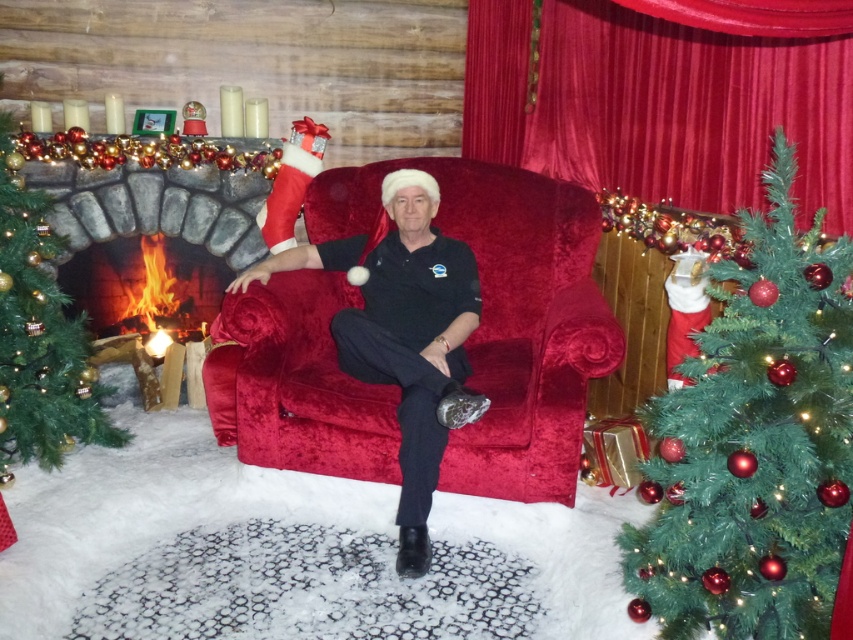
In the scene shown: Is velvet black shirt at center in front of black velvet pants at center?

That is True.

Is point (480, 413) more distant than point (349, 326)?

No, it is in front of (349, 326).

The height and width of the screenshot is (640, 853). Identify the location of velvet black shirt at center. (404, 336).

In the scene shown: Between velvet curtain at upper center and black velvet pants at center, which one has more height?

velvet curtain at upper center

Is velvet curtain at upper center positioned in front of black velvet pants at center?

Yes.

Where is `velvet curtain at upper center`? velvet curtain at upper center is located at coordinates (659, 106).

The width and height of the screenshot is (853, 640). I want to click on velvet curtain at upper center, so click(x=659, y=106).

Is point (737, 275) positioned before point (59, 449)?

Yes, it is.

Is the position of green textured christmas tree at center more distant than that of green matte christmas tree at left?

No, green textured christmas tree at center is in front of green matte christmas tree at left.

Is point (817, 596) in front of point (24, 417)?

Yes.

You are a GUI agent. You are given a task and a screenshot of the screen. Output one action in this format:
    pyautogui.click(x=<x>, y=<y>)
    Task: Click on the green textured christmas tree at center
    This screenshot has height=640, width=853.
    Given the screenshot: What is the action you would take?
    pyautogui.click(x=756, y=442)